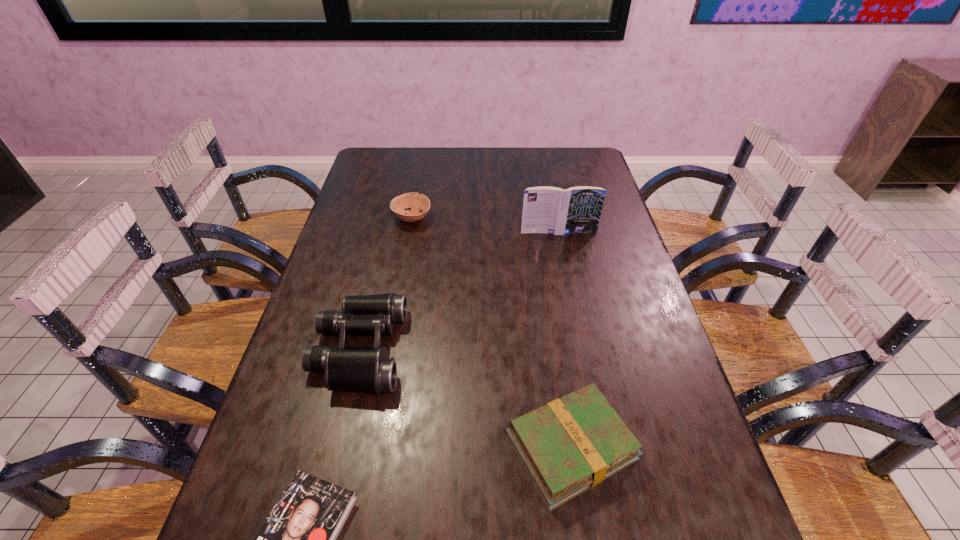
The width and height of the screenshot is (960, 540). Find the location of `the tallest object`. the tallest object is located at coordinates (551, 210).

Locate an element on the screen. The height and width of the screenshot is (540, 960). the farthest book is located at coordinates (551, 210).

Locate an element on the screen. This screenshot has width=960, height=540. binoculars is located at coordinates (355, 369).

Find the location of a particular element. bowl is located at coordinates click(417, 202).

The image size is (960, 540). I want to click on the second shortest book, so [x=571, y=444].

What are the coordinates of `vacant space located 0.400m on the front cover of the tallest object` in the screenshot? It's located at (580, 336).

Where is `free space located on the front-facing side of the second tallest object`? This screenshot has width=960, height=540. free space located on the front-facing side of the second tallest object is located at coordinates 464,349.

The width and height of the screenshot is (960, 540). I want to click on free region located on the right of the bowl, so click(x=490, y=218).

At what (x,y) coordinates should I click in order to perform the action: click on free space located on the back of the second shortest book. Please return your answer as a coordinate pair (x, y). Looking at the image, I should click on (550, 309).

Where is `binoculars present at the left edge`? binoculars present at the left edge is located at coordinates (355, 369).